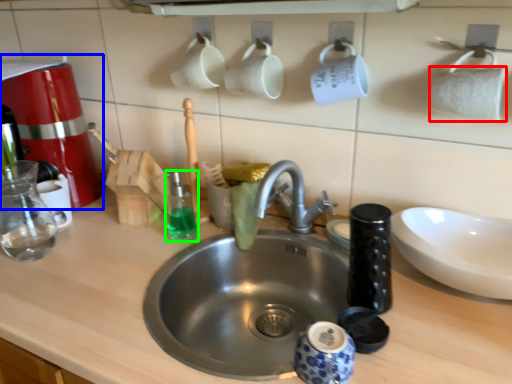
Question: Which object is positioned farthest from toilet paper (highlighted by a red box)? Select from coffee machine (highlighted by a blue box) and cleaning product (highlighted by a green box).

Choices:
 (A) coffee machine
 (B) cleaning product

Answer: (A)